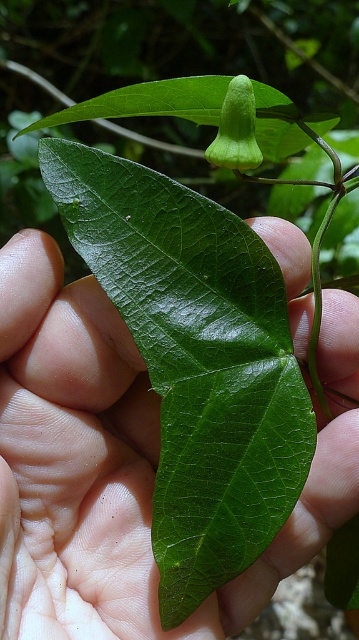
Question: Which of the following is the closest to the observer?

Choices:
 (A) green matte flower at upper center
 (B) green glossy leaf at center

Answer: (B)

Question: Among these points, which one is nearest to the camera?

Choices:
 (A) (252, 168)
 (B) (202, 376)

Answer: (B)

Question: Does green glossy leaf at center have a larger size compared to green matte flower at upper center?

Choices:
 (A) no
 (B) yes

Answer: (B)

Question: Observing the image, what is the correct spatial positioning of green glossy leaf at center in reference to green matte flower at upper center?

Choices:
 (A) below
 (B) above

Answer: (A)

Question: From the image, what is the correct spatial relationship of green glossy leaf at center in relation to green matte flower at upper center?

Choices:
 (A) above
 (B) below

Answer: (B)